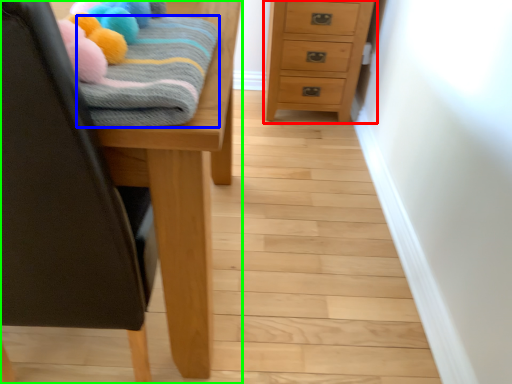
Question: Which object is positioned closest to chest of drawers (highlighted by a red box)? Select from bath towel (highlighted by a blue box) and furniture (highlighted by a green box).

Choices:
 (A) bath towel
 (B) furniture

Answer: (B)